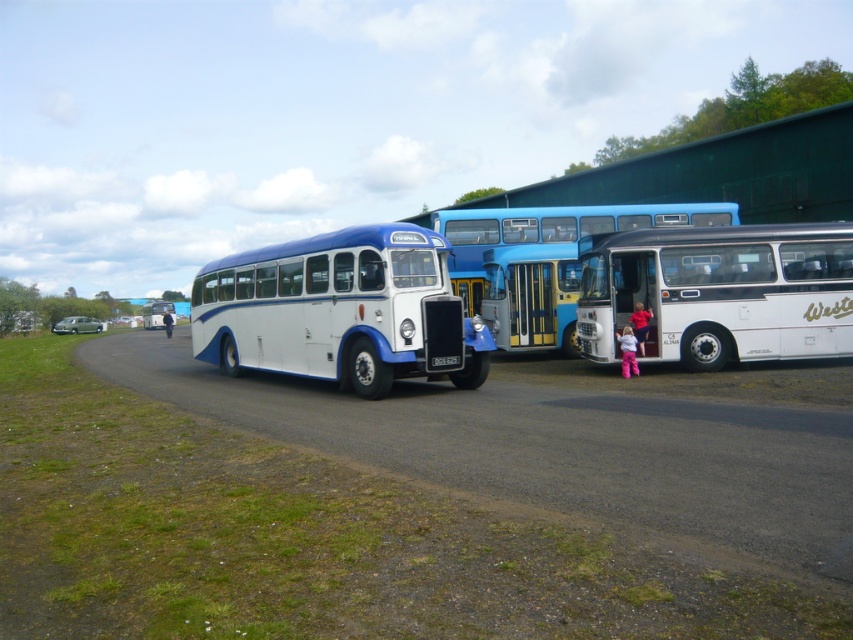
You are standing at the bus station and want to reach a specific point marked at coordinates point [833,248]. If you walk straight from your current position, will you reach that point within 16 meters?

The distance between point [833,248] and the viewer is 15.61 meters, so yes, you can reach it within 16 meters by walking straight.

You are standing at the entrance of the bus station and want to board the white matte bus at center. According to the coordinates given, in which direction should you walk to reach it?

The white matte bus at center is located at coordinates point (721, 292). Since the coordinate system typically places (0, 0) at the bottom left corner, you should walk towards the upper right direction to reach it.